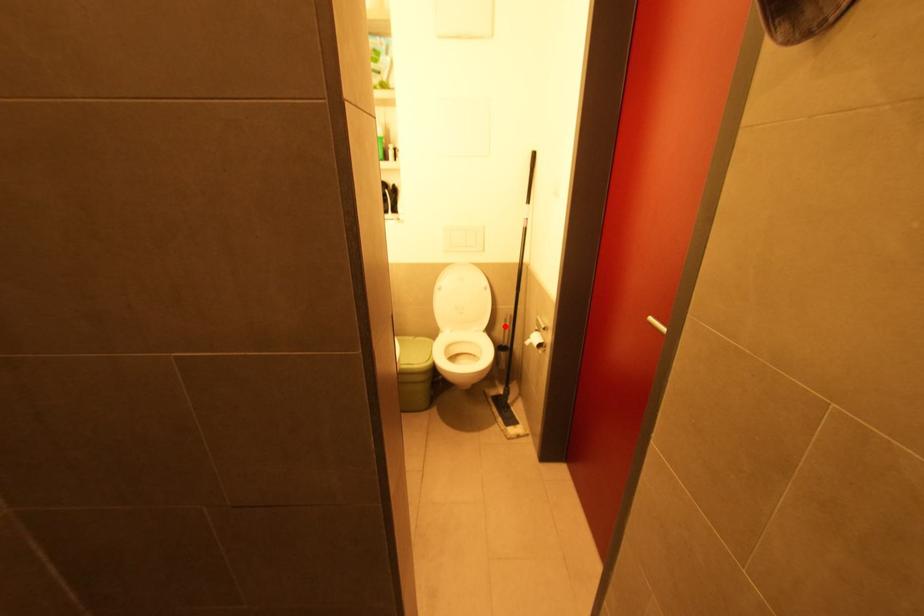
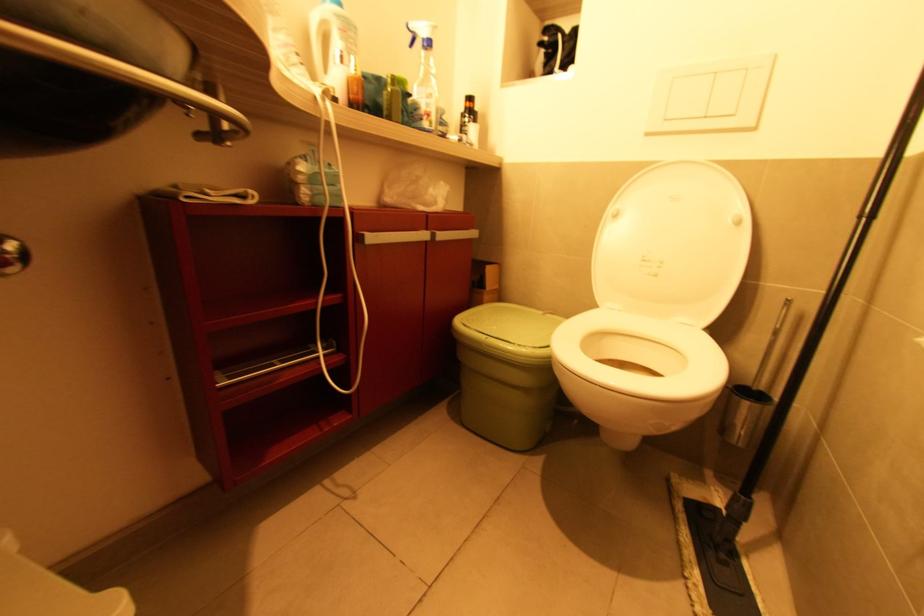
The point at the highlighted location is marked in the first image. Where is the corresponding point in the second image?

(771, 338)